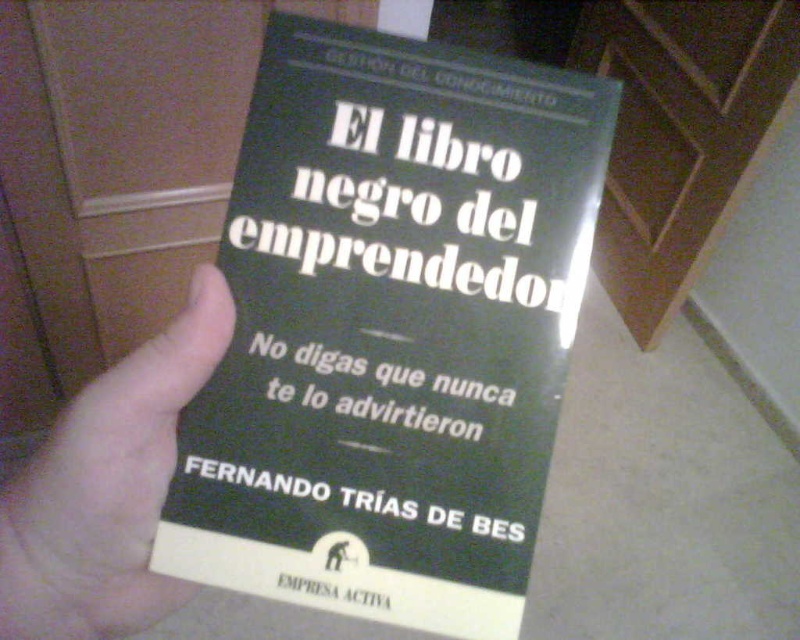
Is matte black book at center above skinny white hand at center?

Indeed, matte black book at center is positioned over skinny white hand at center.

Between matte black book at center and skinny white hand at center, which one has less height?

skinny white hand at center

Is point (392, 404) closer to viewer compared to point (88, 573)?

That is False.

Where is `matte black book at center`? Image resolution: width=800 pixels, height=640 pixels. matte black book at center is located at coordinates (392, 330).